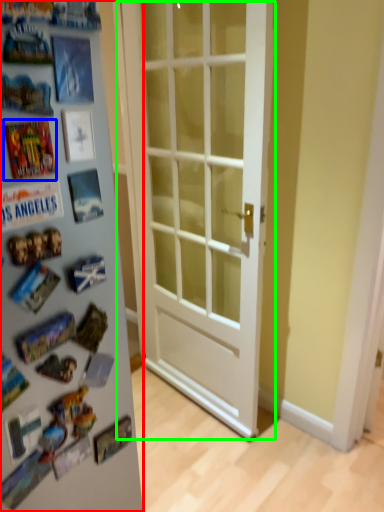
Question: Which object is positioned farthest from fridge (highlighted by a red box)? Select from comic book (highlighted by a blue box) and door (highlighted by a green box).

Choices:
 (A) comic book
 (B) door

Answer: (B)